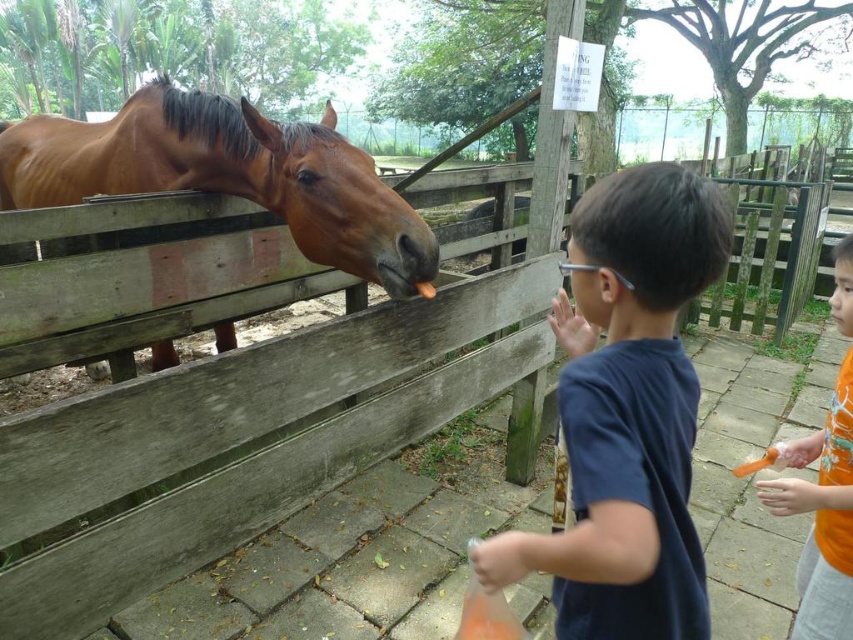
Question: Which object appears closest to the camera in this image?

Choices:
 (A) brown glossy horse at left
 (B) orange fabric shirt at right
 (C) dark blue t-shirt at center

Answer: (C)

Question: Is dark blue t-shirt at center above orange fabric shirt at right?

Choices:
 (A) yes
 (B) no

Answer: (A)

Question: Which of the following is the farthest from the observer?

Choices:
 (A) orange fabric shirt at right
 (B) brown glossy horse at left
 (C) dark blue t-shirt at center

Answer: (B)

Question: Considering the real-world distances, which object is closest to the orange fabric shirt at right?

Choices:
 (A) brown glossy horse at left
 (B) dark blue t-shirt at center

Answer: (B)

Question: Is brown glossy horse at left smaller than orange fabric shirt at right?

Choices:
 (A) yes
 (B) no

Answer: (B)

Question: Does brown glossy horse at left have a lesser width compared to orange fabric shirt at right?

Choices:
 (A) yes
 (B) no

Answer: (B)